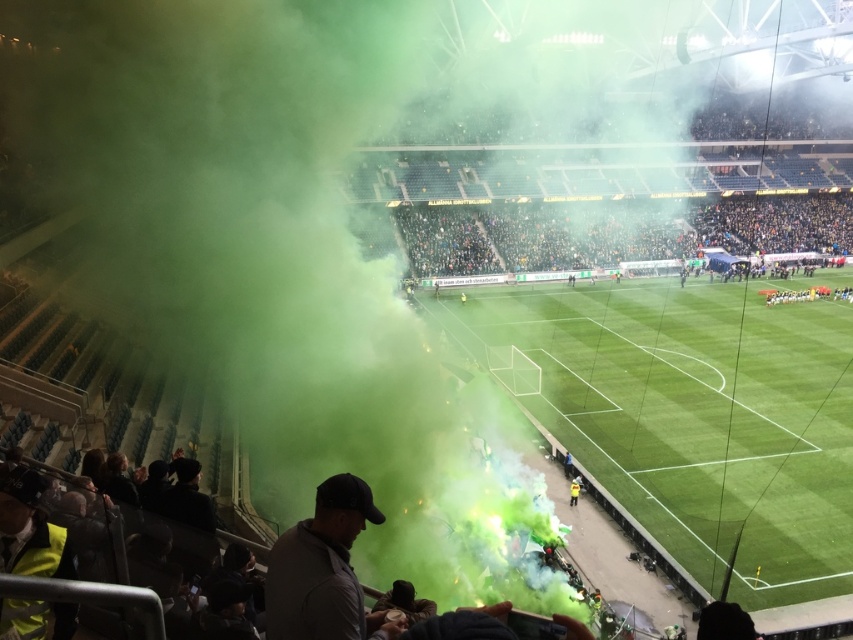
Can you confirm if green smoke at left is bigger than green grass football field at center?

Yes, green smoke at left is bigger than green grass football field at center.

Is point (309, 16) behind point (590, 339)?

That is True.

Where is `green smoke at left`? This screenshot has width=853, height=640. green smoke at left is located at coordinates (248, 230).